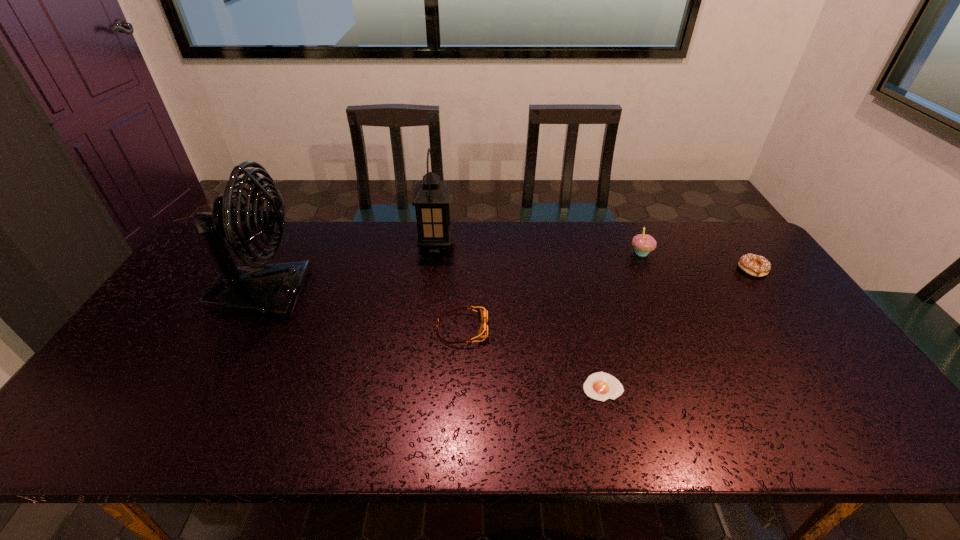
The image size is (960, 540). Identify the location of vacant space that satisfies the following two spatial constraints: 1. on the front side of the third tallest object; 2. in front of the leftmost object to blow air. (660, 294).

Image resolution: width=960 pixels, height=540 pixels. What are the coordinates of `blank space that satisfies the following two spatial constraints: 1. in front of the leftmost object to blow air; 2. on the back side of the third object from right to left` in the screenshot? It's located at (212, 387).

Locate an element on the screen. free space that satisfies the following two spatial constraints: 1. on the front side of the doughnut; 2. with the lenses facing forward on the goggles is located at coordinates (795, 329).

The image size is (960, 540). Identify the location of vacant region that satisfies the following two spatial constraints: 1. on the front side of the second tallest object; 2. on the left side of the fourth shortest object. (435, 253).